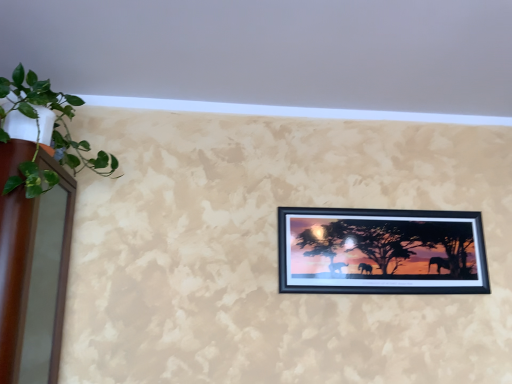
The height and width of the screenshot is (384, 512). Describe the element at coordinates (381, 251) in the screenshot. I see `black matte picture frame at center` at that location.

What do you see at coordinates (273, 56) in the screenshot? I see `beige textured wall at upper center` at bounding box center [273, 56].

You are a GUI agent. You are given a task and a screenshot of the screen. Output one action in this format:
    pyautogui.click(x=<x>, y=<y>)
    Task: Click on the black matte picture frame at center
    This screenshot has height=384, width=512.
    Given the screenshot: What is the action you would take?
    pyautogui.click(x=381, y=251)

From the picture: Considering the sizes of objects black matte picture frame at center and green leafy plant at left in the image provided, who is bigger, black matte picture frame at center or green leafy plant at left?

green leafy plant at left is bigger.

Find the location of a particular element. Image resolution: width=512 pixels, height=384 pixels. houseplant on the left of black matte picture frame at center is located at coordinates (51, 134).

Considering the positions of objects black matte picture frame at center and green leafy plant at left in the image provided, who is more to the right, black matte picture frame at center or green leafy plant at left?

Positioned to the right is black matte picture frame at center.

Considering the sizes of objects green leafy plant at left and black matte picture frame at center in the image provided, who is shorter, green leafy plant at left or black matte picture frame at center?

With less height is black matte picture frame at center.

Are green leafy plant at left and black matte picture frame at center located far from each other?

Yes, green leafy plant at left and black matte picture frame at center are quite far apart.

How different are the orientations of green leafy plant at left and black matte picture frame at center in degrees?

The facing directions of green leafy plant at left and black matte picture frame at center are 89.4 degrees apart.

From the image's perspective, would you say beige textured wall at upper center is shown under green leafy plant at left?

Incorrect, from the image's perspective, beige textured wall at upper center is higher than green leafy plant at left.

Can you confirm if beige textured wall at upper center is bigger than green leafy plant at left?

Yes.

Is point (140, 38) closer or farther from the camera than point (62, 98)?

Clearly, point (140, 38) is closer to the camera than point (62, 98).

Is the surface of beige textured wall at upper center in direct contact with green leafy plant at left?

No, beige textured wall at upper center is not next to green leafy plant at left.

Which is behind, black matte picture frame at center or beige textured wall at upper center?

Positioned behind is black matte picture frame at center.

Is black matte picture frame at center wider or thinner than beige textured wall at upper center?

black matte picture frame at center is thinner than beige textured wall at upper center.

From a real-world perspective, is black matte picture frame at center positioned over beige textured wall at upper center based on gravity?

Incorrect, from a real-world perspective, black matte picture frame at center is lower than beige textured wall at upper center.

How much distance is there between black matte picture frame at center and beige textured wall at upper center?

The distance of black matte picture frame at center from beige textured wall at upper center is 31.00 inches.

Do you think green leafy plant at left is within beige textured wall at upper center, or outside of it?

green leafy plant at left is located beyond the bounds of beige textured wall at upper center.

Could you tell me if green leafy plant at left is facing beige textured wall at upper center?

Yes, green leafy plant at left is facing beige textured wall at upper center.

Is green leafy plant at left not near beige textured wall at upper center?

No.

Does green leafy plant at left have a greater height compared to beige textured wall at upper center?

Yes.

Consider the image. From a real-world perspective, which object stands above the other?

From a 3D spatial view, beige textured wall at upper center is above.

At what (x,y) coordinates should I click in order to perform the action: click on backdrop above the black matte picture frame at center (from a real-world perspective). Please return your answer as a coordinate pair (x, y). The width and height of the screenshot is (512, 384). Looking at the image, I should click on (273, 56).

Is beige textured wall at upper center to the right of black matte picture frame at center from the viewer's perspective?

No.

You are a GUI agent. You are given a task and a screenshot of the screen. Output one action in this format:
    pyautogui.click(x=<x>, y=<y>)
    Task: Click on the picture frame below the green leafy plant at left (from a real-world perspective)
    Image resolution: width=512 pixels, height=384 pixels.
    Given the screenshot: What is the action you would take?
    pyautogui.click(x=381, y=251)

Image resolution: width=512 pixels, height=384 pixels. What are the coordinates of `houseplant above the black matte picture frame at center (from the image's perspective)` in the screenshot? It's located at (51, 134).

Estimate the real-world distances between objects in this image. Which object is further from green leafy plant at left, beige textured wall at upper center or black matte picture frame at center?

black matte picture frame at center is further to green leafy plant at left.

Which object lies further to the anchor point black matte picture frame at center, green leafy plant at left or beige textured wall at upper center?

green leafy plant at left.

Which object lies nearer to the anchor point beige textured wall at upper center, black matte picture frame at center or green leafy plant at left?

Based on the image, black matte picture frame at center appears to be nearer to beige textured wall at upper center.

When comparing their distances from beige textured wall at upper center, does green leafy plant at left or black matte picture frame at center seem closer?

black matte picture frame at center.

When comparing their distances from green leafy plant at left, does black matte picture frame at center or beige textured wall at upper center seem closer?

beige textured wall at upper center.

Consider the image. When comparing their distances from black matte picture frame at center, does beige textured wall at upper center or green leafy plant at left seem further?

Among the two, green leafy plant at left is located further to black matte picture frame at center.

Image resolution: width=512 pixels, height=384 pixels. Identify the location of backdrop situated between green leafy plant at left and black matte picture frame at center from left to right. (273, 56).